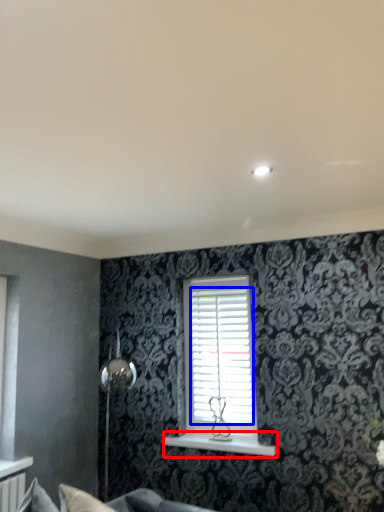
Question: Which point is further to the camera, window sill (highlighted by a red box) or shutter (highlighted by a blue box)?

Choices:
 (A) window sill
 (B) shutter

Answer: (B)